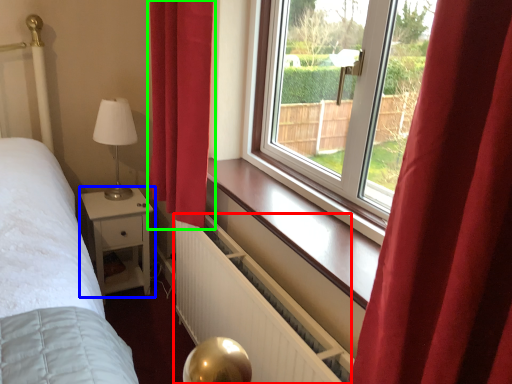
Question: Which object is positioned farthest from radiator (highlighted by a red box)? Select from nightstand (highlighted by a blue box) and curtain (highlighted by a green box).

Choices:
 (A) nightstand
 (B) curtain

Answer: (A)